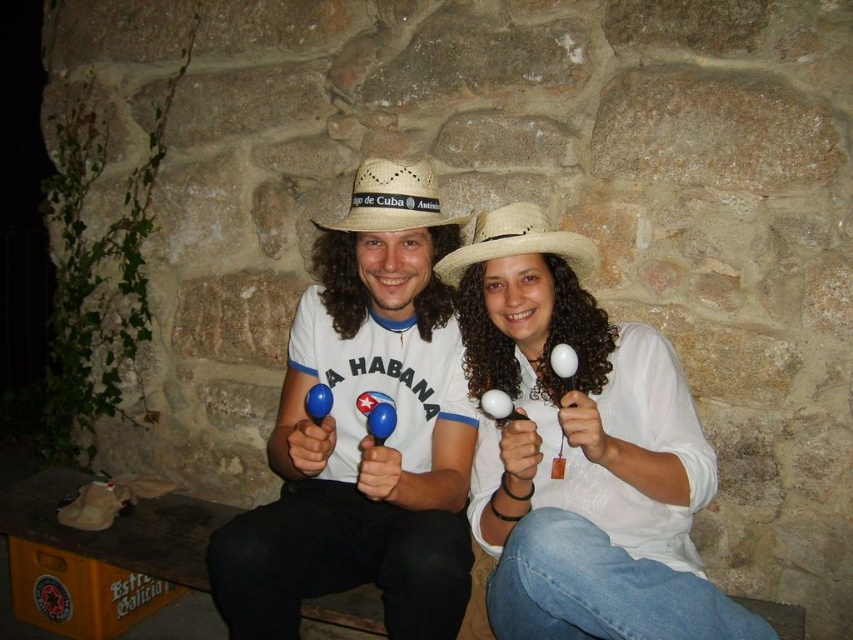
Does white matte maracas at center lie behind white woven straw sombrero at center?

No, it is in front of white woven straw sombrero at center.

Who is positioned more to the right, white matte maracas at center or white woven straw sombrero at center?

From the viewer's perspective, white matte maracas at center appears more on the right side.

I want to click on white matte maracas at center, so click(581, 451).

Which is above, white woven straw sombrero at center or beige straw cowboy hat at center?

beige straw cowboy hat at center is above.

Between point (368, 176) and point (363, 186), which one is positioned in front?

Point (368, 176) is in front.

Locate an element on the screen. The width and height of the screenshot is (853, 640). white woven straw sombrero at center is located at coordinates (393, 198).

Does white matte maracas at center appear on the left side of natural straw cowboy hat at center?

Incorrect, white matte maracas at center is not on the left side of natural straw cowboy hat at center.

Who is more forward, (506, 476) or (587, 275)?

Point (506, 476) is more forward.

Is point (554, 236) closer to viewer compared to point (473, 259)?

Yes, it is.

Identify the location of white matte maracas at center. (581, 451).